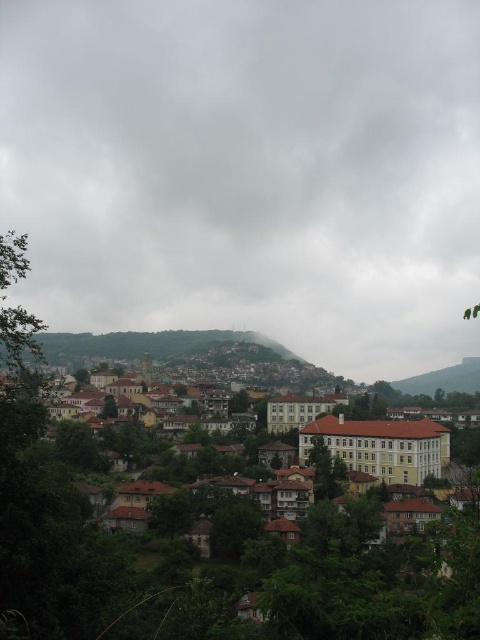
You are standing in the hilly town and looking at the cloudy gray sky at upper center and the brown wooden houses at lower center. Which object is closer to you?

The brown wooden houses at lower center are closer to you because the cloudy gray sky at upper center is further away.

You are standing in the hilly town scene and want to reach the point marked as point (93, 38). Given that you can walk 100 meters per minute, how many minutes will it take you to reach that point?

The point (93, 38) is 489.87 meters away from the viewer. At a walking speed of 100 meters per minute, it would take approximately 4.9 minutes to reach the point.

You are an architect planning to build a new house in the town. You want to ensure that the new house won not block the view of the cloudy gray sky at upper center from the brown wooden houses at lower center. What should you consider about the height of the new house?

The cloudy gray sky at upper center is much taller than the brown wooden houses at lower center, so the new house should be built with a height lower than the current brown wooden houses at lower center to ensure the view of the cloudy gray sky at upper center remains unobstructed.